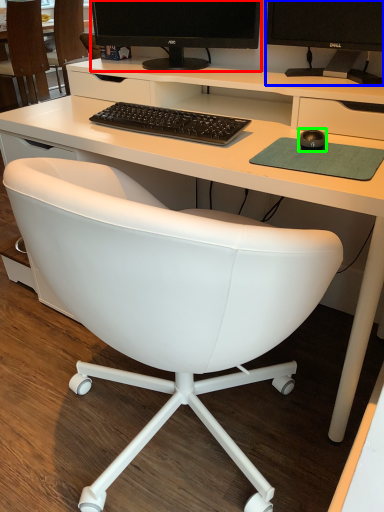
Question: Based on their relative distances, which object is farther from computer monitor (highlighted by a red box)? Choose from television (highlighted by a blue box) and mouse (highlighted by a green box).

Choices:
 (A) television
 (B) mouse

Answer: (B)